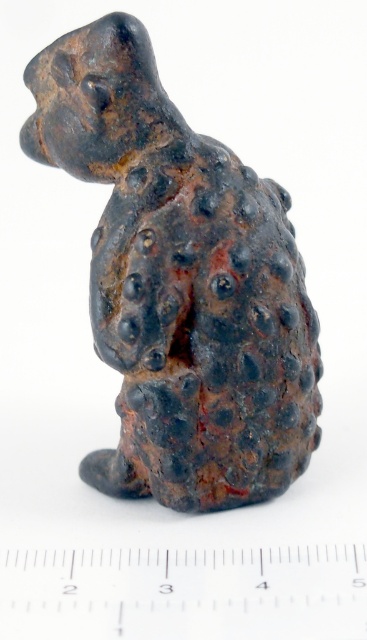
Question: Can you confirm if rusty metal dog at center is smaller than white plastic ruler at center?

Choices:
 (A) yes
 (B) no

Answer: (B)

Question: Can you confirm if rusty metal dog at center is smaller than white plastic ruler at center?

Choices:
 (A) yes
 (B) no

Answer: (B)

Question: Is rusty metal dog at center below white plastic ruler at center?

Choices:
 (A) no
 (B) yes

Answer: (A)

Question: Which point is closer to the camera taking this photo?

Choices:
 (A) (136, 84)
 (B) (198, 589)

Answer: (B)

Question: Which point appears farthest from the camera in this image?

Choices:
 (A) (220, 365)
 (B) (234, 605)

Answer: (A)